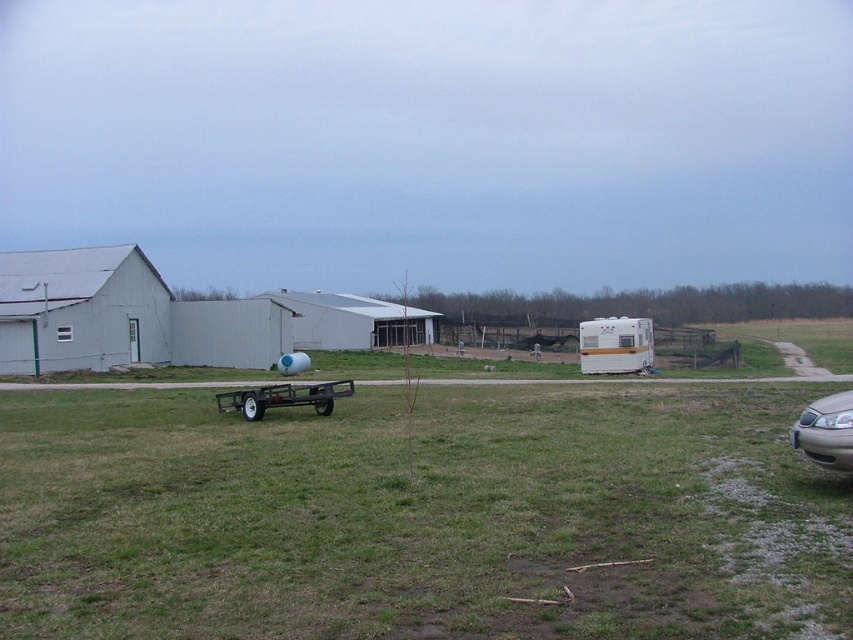
You are standing at the point with coordinates point (80, 308). Based on the scene, what object is directly in front of you?

The point (80, 308) corresponds to the white matte barn at left, so the white matte barn at left is directly in front of you.

You are a farmer planning to move the metallic trailer at center closer to the white matte barn at center. Given their widths, which one would require more space to maneuver around when moving them side by side? Please explain your reasoning based on their sizes.

The white matte barn at center has a greater width than the metallic trailer at center. Therefore, moving them side by side would require more space to maneuver around the white matte barn at center due to its larger size.

Based on the photo, you are standing in the rural scene and want to walk from the white matte barn at center to the green grass at center. Which direction should you head?

The green grass at center is positioned on the right side of white matte barn at center, so you should head to the right to reach it.